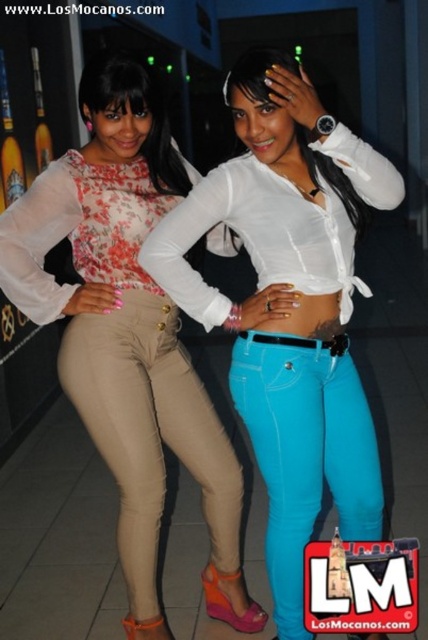
Measure the distance between white glossy shirt at center and camera.

white glossy shirt at center and camera are 5.52 feet apart from each other.

Does point (315, 109) come closer to viewer compared to point (50, 173)?

That is True.

Locate an element on the screen. This screenshot has height=640, width=428. white glossy shirt at center is located at coordinates (290, 307).

Locate an element on the screen. white glossy shirt at center is located at coordinates (290, 307).

Which of these two, matte floral blouse at center or beige leather pants at left, stands taller?

matte floral blouse at center

Is matte floral blouse at center bigger than beige leather pants at left?

Indeed, matte floral blouse at center has a larger size compared to beige leather pants at left.

Is point (107, 380) positioned behind point (193, 380)?

No, it is in front of (193, 380).

Identify the location of matte floral blouse at center. (128, 333).

The height and width of the screenshot is (640, 428). Identify the location of white glossy shirt at center. (290, 307).

Who is positioned more to the left, white glossy shirt at center or beige leather pants at left?

beige leather pants at left

Between point (294, 157) and point (222, 452), which one is positioned behind?

The point (222, 452) is behind.

Find the location of a particular element. white glossy shirt at center is located at coordinates click(x=290, y=307).